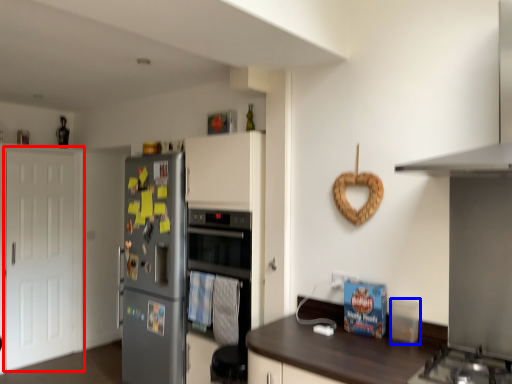
Question: Which of the following is the closest to the observer, door (highlighted by a red box) or appliance (highlighted by a blue box)?

Choices:
 (A) door
 (B) appliance

Answer: (B)